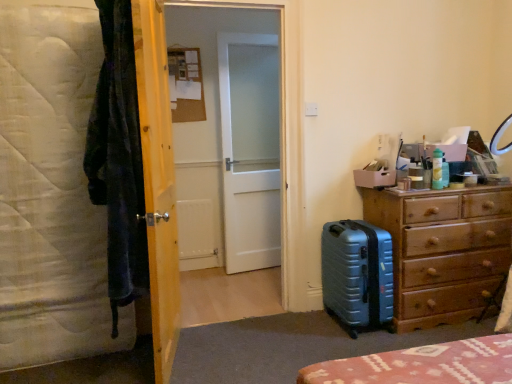
This screenshot has width=512, height=384. I want to click on free space underneath wooden door at center (from a real-world perspective), so click(x=181, y=345).